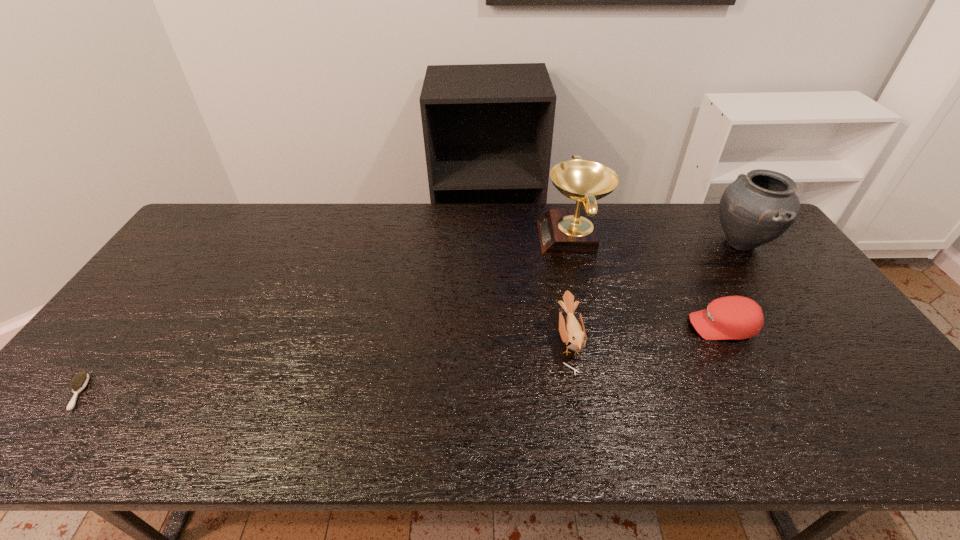
The height and width of the screenshot is (540, 960). Identify the location of vacant space situated on the front of the rightmost object. (797, 324).

This screenshot has width=960, height=540. In order to click on vacant space positioned at the beak of the bird in this screenshot , I will do `click(496, 341)`.

Where is `free location located at the beak of the bird`? The image size is (960, 540). free location located at the beak of the bird is located at coordinates (489, 341).

In order to click on vacant region located 0.200m at the beak of the bird in this screenshot , I will do `click(481, 341)`.

The image size is (960, 540). What are the coordinates of `vacant space situated 0.110m on the front-facing side of the fourth tallest object` in the screenshot? It's located at (648, 326).

Where is `vacant space situated on the front-facing side of the fourth tallest object`? vacant space situated on the front-facing side of the fourth tallest object is located at coordinates (548, 326).

The width and height of the screenshot is (960, 540). In order to click on free space located on the front-facing side of the fourth tallest object in this screenshot , I will do `click(548, 326)`.

Locate an element on the screen. The width and height of the screenshot is (960, 540). vacant area located on the back of the scrubbing brush is located at coordinates (x=172, y=268).

I want to click on award present at the far edge, so click(562, 231).

The width and height of the screenshot is (960, 540). In order to click on urn that is positioned at the far edge in this screenshot , I will do [x=757, y=208].